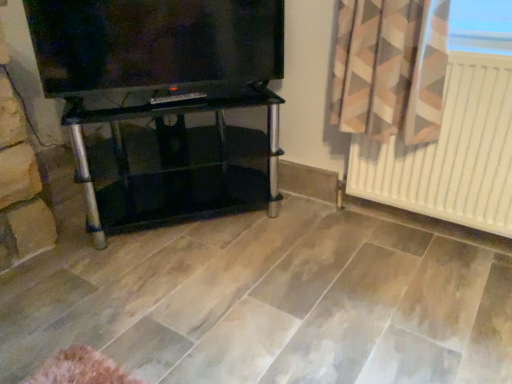
This screenshot has width=512, height=384. In order to click on matte black tv at upper left in this screenshot , I will do `click(154, 43)`.

This screenshot has width=512, height=384. Describe the element at coordinates (154, 43) in the screenshot. I see `matte black tv at upper left` at that location.

I want to click on matte black tv at upper left, so click(154, 43).

Is black glass tv stand at center placed right next to matte black tv at upper left?

No, black glass tv stand at center is not making contact with matte black tv at upper left.

Considering the positions of objects black glass tv stand at center and matte black tv at upper left in the image provided, who is more to the left, black glass tv stand at center or matte black tv at upper left?

Positioned to the left is matte black tv at upper left.

Is black glass tv stand at center not inside matte black tv at upper left?

Yes, black glass tv stand at center is outside of matte black tv at upper left.

Does black glass tv stand at center come behind matte black tv at upper left?

Yes, the depth of black glass tv stand at center is greater than that of matte black tv at upper left.

Which object is positioned more to the left, black glass tv stand at center or white matte radiator at right?

black glass tv stand at center.

Is black glass tv stand at center positioned in front of white matte radiator at right?

No.

Is black glass tv stand at center bigger or smaller than white matte radiator at right?

In the image, black glass tv stand at center appears to be larger than white matte radiator at right.

Is black glass tv stand at center positioned beyond the bounds of white matte radiator at right?

Yes, black glass tv stand at center is not within white matte radiator at right.

Is matte black tv at upper left far from white matte radiator at right?

They are positioned close to each other.

Considering the sizes of objects matte black tv at upper left and white matte radiator at right in the image provided, who is taller, matte black tv at upper left or white matte radiator at right?

white matte radiator at right.

Could white matte radiator at right be considered to be inside matte black tv at upper left?

No, white matte radiator at right is not surrounded by matte black tv at upper left.

From the image's perspective, which is below, matte black tv at upper left or white matte radiator at right?

white matte radiator at right appears lower in the image.

Which is correct: white matte radiator at right is inside black glass tv stand at center, or outside of it?

white matte radiator at right is spatially situated outside black glass tv stand at center.

Could you tell me if white matte radiator at right is turned towards black glass tv stand at center?

No, white matte radiator at right is not facing towards black glass tv stand at center.

Can you confirm if white matte radiator at right is shorter than black glass tv stand at center?

No.

In terms of width, does white matte radiator at right look wider or thinner when compared to black glass tv stand at center?

Clearly, white matte radiator at right has less width compared to black glass tv stand at center.

Is white matte radiator at right aimed at matte black tv at upper left?

No, white matte radiator at right is not turned towards matte black tv at upper left.

From the image's perspective, relative to matte black tv at upper left, is white matte radiator at right above or below?

Clearly, from the image's perspective, white matte radiator at right is below matte black tv at upper left.

Considering the sizes of white matte radiator at right and matte black tv at upper left in the image, is white matte radiator at right taller or shorter than matte black tv at upper left?

Considering their sizes, white matte radiator at right has more height than matte black tv at upper left.

Who is shorter, matte black tv at upper left or black glass tv stand at center?

matte black tv at upper left.

Between matte black tv at upper left and black glass tv stand at center, which one has smaller width?

matte black tv at upper left.

Does point (258, 33) appear closer or farther from the camera than point (249, 178)?

Point (258, 33) is closer to the camera than point (249, 178).

Would you say matte black tv at upper left contains black glass tv stand at center?

No, black glass tv stand at center is not surrounded by matte black tv at upper left.

You are a GUI agent. You are given a task and a screenshot of the screen. Output one action in this format:
    pyautogui.click(x=<x>, y=<y>)
    Task: Click on the furniture that appears below the matte black tv at upper left (from a real-world perspective)
    
    Given the screenshot: What is the action you would take?
    pyautogui.click(x=181, y=165)

At what (x,y) coordinates should I click in order to perform the action: click on radiator that is on the right side of black glass tv stand at center. Please return your answer as a coordinate pair (x, y). Looking at the image, I should click on (450, 153).

When comparing their distances from white matte radiator at right, does black glass tv stand at center or matte black tv at upper left seem closer?

The object closer to white matte radiator at right is matte black tv at upper left.

Considering their positions, is black glass tv stand at center positioned further to matte black tv at upper left than white matte radiator at right?

The object further to matte black tv at upper left is white matte radiator at right.

Based on their spatial positions, is matte black tv at upper left or black glass tv stand at center closer to white matte radiator at right?

Among the two, matte black tv at upper left is located nearer to white matte radiator at right.

Which object lies further to the anchor point matte black tv at upper left, white matte radiator at right or black glass tv stand at center?

white matte radiator at right is positioned further to the anchor matte black tv at upper left.

Considering their positions, is white matte radiator at right positioned closer to black glass tv stand at center than matte black tv at upper left?

Answer: The object closer to black glass tv stand at center is matte black tv at upper left.

Which object lies nearer to the anchor point black glass tv stand at center, matte black tv at upper left or white matte radiator at right?

matte black tv at upper left lies closer to black glass tv stand at center than the other object.

Where is `furniture located between matte black tv at upper left and white matte radiator at right in the left-right direction`? furniture located between matte black tv at upper left and white matte radiator at right in the left-right direction is located at coordinates (181, 165).